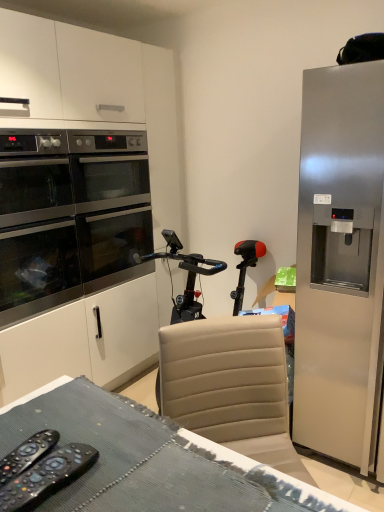
Question: In terms of size, does black plastic remote control at lower left, the second remote control when ordered from right to left, appear bigger or smaller than satin silver refrigerator at right?

Choices:
 (A) big
 (B) small

Answer: (B)

Question: From a real-world perspective, is black plastic remote control at lower left, which ranks as the first remote control in left-to-right order, positioned above or below satin silver refrigerator at right?

Choices:
 (A) below
 (B) above

Answer: (B)

Question: Which of these objects is positioned farthest from the satin silver refrigerator at right?

Choices:
 (A) stainless steel oven at left
 (B) textured gray fabric desk at center
 (C) black plastic remote controls at lower left, the 1th remote control positioned from the right
 (D) black plastic remote control at lower left, which ranks as the first remote control in left-to-right order

Answer: (D)

Question: Considering the real-world distances, which object is closest to the textured gray fabric desk at center?

Choices:
 (A) stainless steel oven at left
 (B) black plastic remote controls at lower left, which ranks as the 2th remote control in left-to-right order
 (C) satin silver refrigerator at right
 (D) black plastic remote control at lower left, the second remote control when ordered from right to left

Answer: (B)